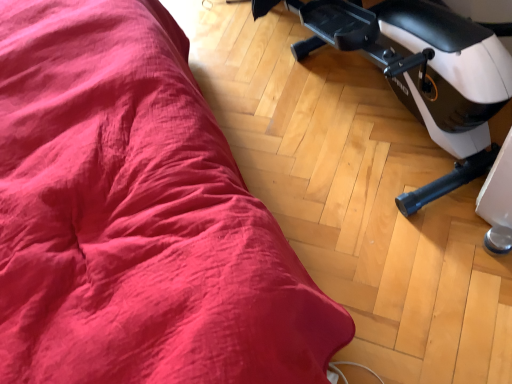
Measure the distance between point (241, 259) and camera.

Point (241, 259) is 26.69 inches away from camera.

Locate an element on the screen. The height and width of the screenshot is (384, 512). matte red bedspread at left is located at coordinates (136, 216).

What do you see at coordinates (136, 216) in the screenshot? This screenshot has height=384, width=512. I see `matte red bedspread at left` at bounding box center [136, 216].

This screenshot has width=512, height=384. In order to click on matte red bedspread at left in this screenshot , I will do `click(136, 216)`.